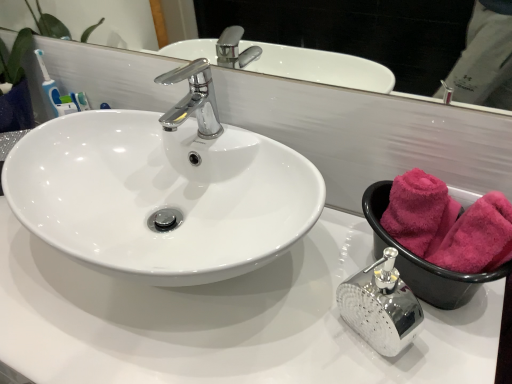
Locate an element on the screen. The height and width of the screenshot is (384, 512). free space between white glossy sink at center and polished chrome soap dispenser at lower right is located at coordinates (334, 308).